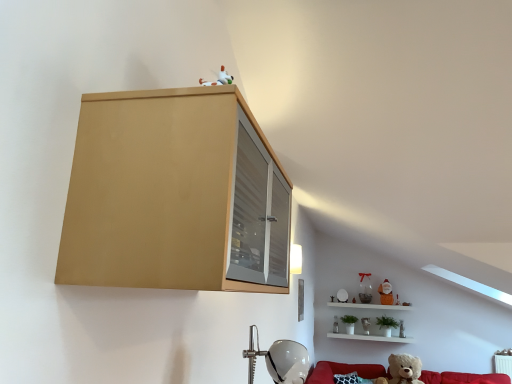
Question: From the image's perspective, is matte wood cabinet at upper left beneath translucent glass vase at lower right, arranged as the fifth toy when viewed from the back?

Choices:
 (A) no
 (B) yes

Answer: (A)

Question: Is translucent glass vase at lower right, which is counted as the 2th toy, starting from the front, completely or partially inside matte wood cabinet at upper left?

Choices:
 (A) yes
 (B) no

Answer: (B)

Question: Does matte wood cabinet at upper left have a greater height compared to translucent glass vase at lower right, arranged as the fifth toy when viewed from the back?

Choices:
 (A) yes
 (B) no

Answer: (A)

Question: Does matte wood cabinet at upper left have a larger size compared to translucent glass vase at lower right, which is counted as the 2th toy, starting from the front?

Choices:
 (A) yes
 (B) no

Answer: (A)

Question: Is matte wood cabinet at upper left wider than translucent glass vase at lower right, arranged as the fifth toy when viewed from the back?

Choices:
 (A) yes
 (B) no

Answer: (A)

Question: Could you tell me if matte wood cabinet at upper left is facing translucent glass vase at lower right, which is counted as the 2th toy, starting from the front?

Choices:
 (A) no
 (B) yes

Answer: (A)

Question: Is red fabric couch at lower right at the left side of white glossy shelf at lower right?

Choices:
 (A) yes
 (B) no

Answer: (B)

Question: From a real-world perspective, does red fabric couch at lower right sit lower than white glossy shelf at lower right?

Choices:
 (A) no
 (B) yes

Answer: (B)

Question: Is red fabric couch at lower right not near white glossy shelf at lower right?

Choices:
 (A) no
 (B) yes

Answer: (A)

Question: Is red fabric couch at lower right behind white glossy shelf at lower right?

Choices:
 (A) no
 (B) yes

Answer: (A)

Question: Does red fabric couch at lower right have a lesser width compared to white glossy shelf at lower right?

Choices:
 (A) no
 (B) yes

Answer: (A)

Question: From the image's perspective, would you say red fabric couch at lower right is shown under white glossy shelf at lower right?

Choices:
 (A) no
 (B) yes

Answer: (B)

Question: Is translucent glass vase at lower right, which is counted as the 2th toy, starting from the front, wider than matte wood cabinet at upper left?

Choices:
 (A) no
 (B) yes

Answer: (A)